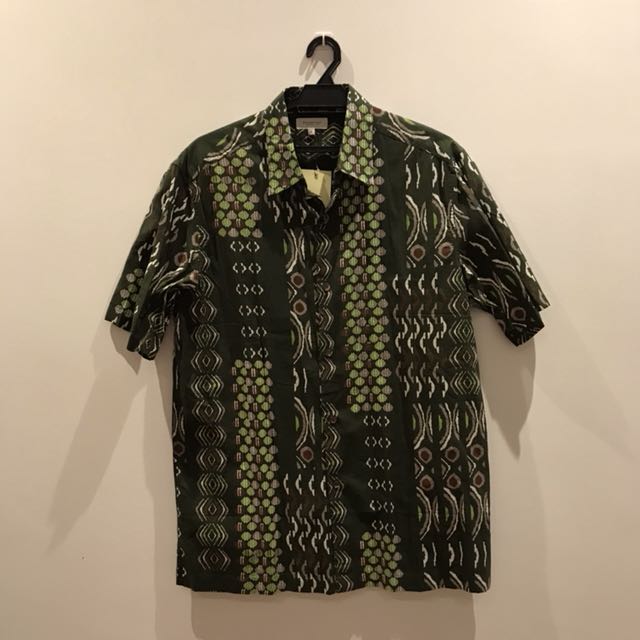
Identify the location of wall. This screenshot has height=640, width=640. (557, 537).